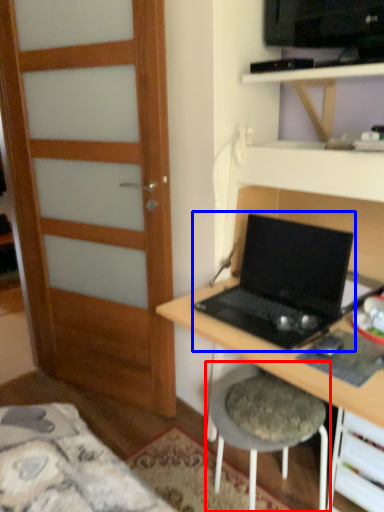
Question: Which object is closer to the camera taking this photo, stool (highlighted by a red box) or laptop (highlighted by a blue box)?

Choices:
 (A) stool
 (B) laptop

Answer: (B)